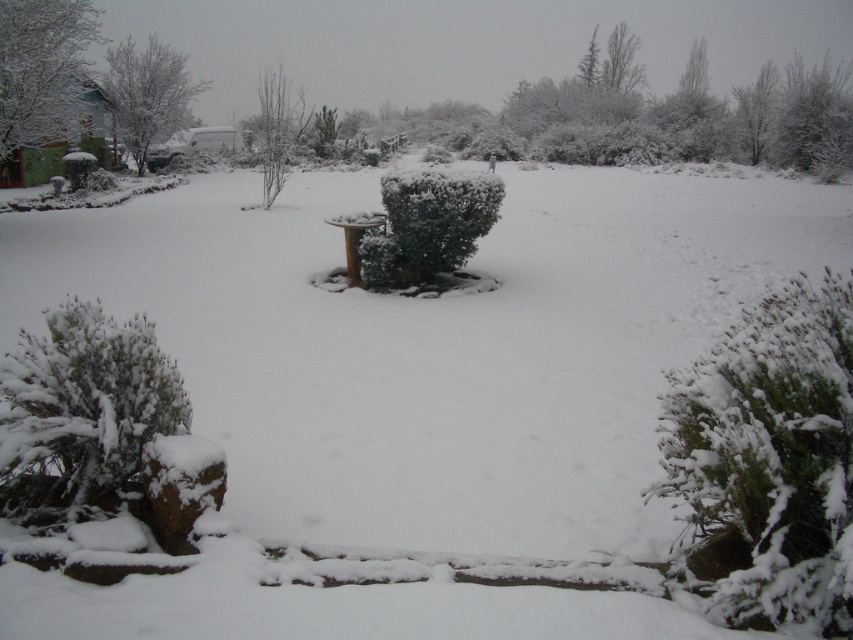
You are standing in the winter backyard scene described. You see a point labeled at coordinates (427, 225). What object is located at that point?

The point at coordinates (427, 225) corresponds to the green matte bush at center.

You are standing in the winter backyard and want to place a small snowman between the bare branches at center and the green leafy tree at upper center. Which object should you place the snowman closer to in order to ensure it is closer to the taller object?

The bare branches at center is taller than the green leafy tree at upper center. Therefore, to place the snowman closer to the taller object, you should position it closer to the bare branches at center.